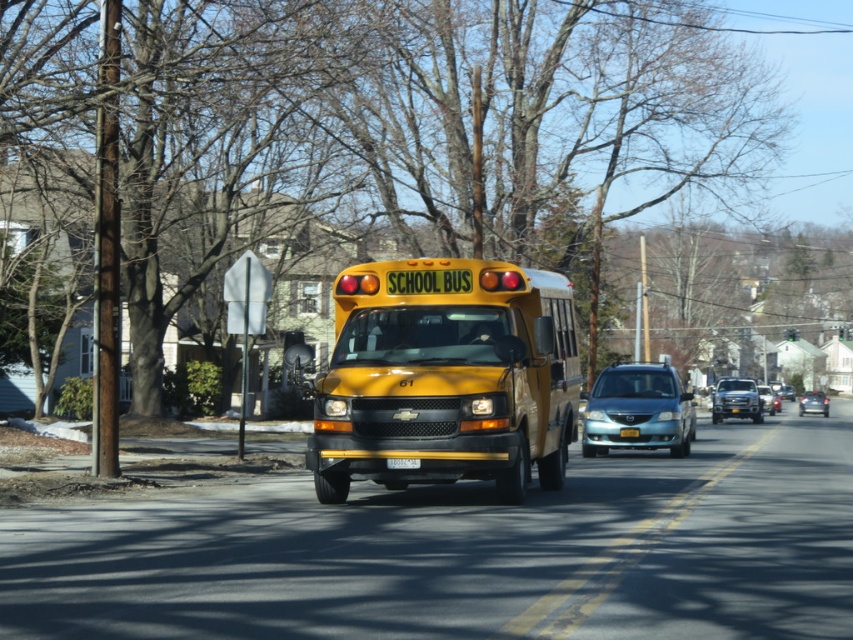
Is point (613, 445) less distant than point (775, 403)?

That is True.

Locate an element on the screen. The image size is (853, 640). metallic blue minivan at center is located at coordinates click(x=637, y=410).

Does yellow matte school bus at center appear under metallic blue minivan at center?

No, yellow matte school bus at center is not below metallic blue minivan at center.

Can you confirm if yellow matte school bus at center is bigger than metallic blue minivan at center?

Correct, yellow matte school bus at center is larger in size than metallic blue minivan at center.

Which is in front, point (558, 477) or point (672, 419)?

Point (558, 477)

The width and height of the screenshot is (853, 640). Find the location of `yellow matte school bus at center`. yellow matte school bus at center is located at coordinates (445, 378).

Measure the distance between metallic blue minivan at center and metallic silver truck at center.

metallic blue minivan at center is 21.65 meters away from metallic silver truck at center.

Locate an element on the screen. The width and height of the screenshot is (853, 640). metallic blue minivan at center is located at coordinates (637, 410).

Identify the location of metallic blue minivan at center. The image size is (853, 640). (637, 410).